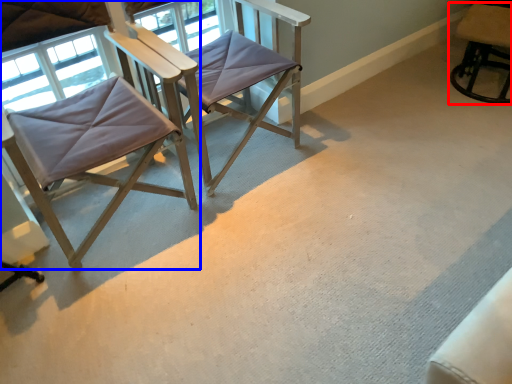
Question: Which object is further to the camera taking this photo, chair (highlighted by a red box) or chair (highlighted by a blue box)?

Choices:
 (A) chair
 (B) chair

Answer: (A)